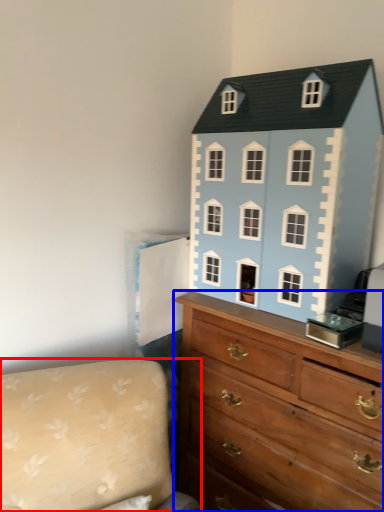
Question: Among these objects, which one is nearest to the camera, couch (highlighted by a red box) or chest of drawers (highlighted by a blue box)?

Choices:
 (A) couch
 (B) chest of drawers

Answer: (A)